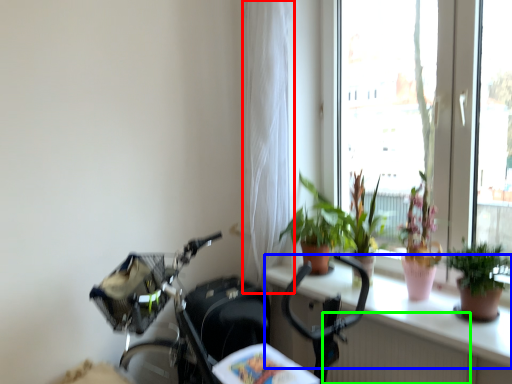
Question: Based on their relative distances, which object is farther from curtain (highlighted by a red box)? Choose from window sill (highlighted by a blue box) and radiator (highlighted by a green box).

Choices:
 (A) window sill
 (B) radiator

Answer: (B)